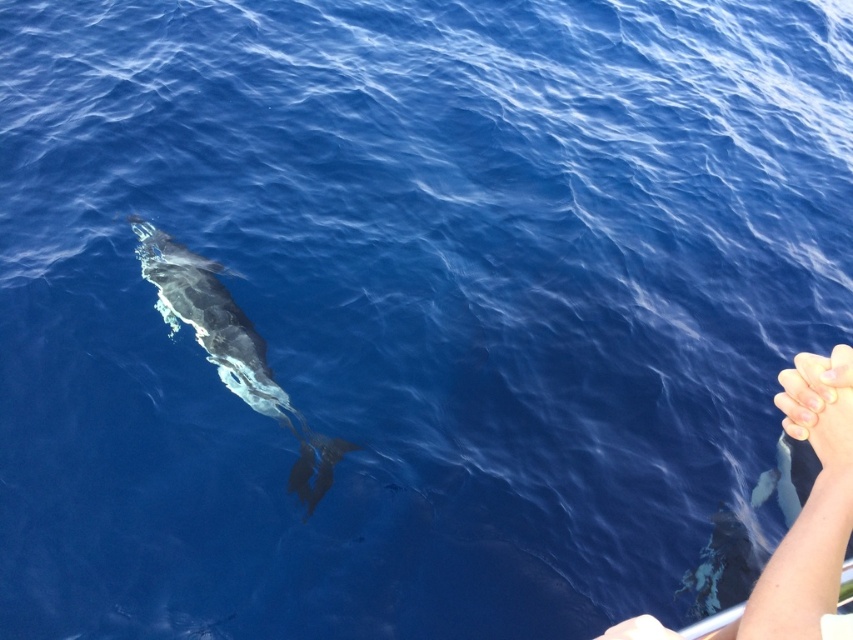
The height and width of the screenshot is (640, 853). What do you see at coordinates (808, 506) in the screenshot?
I see `skinny white arm at lower right` at bounding box center [808, 506].

Between skinny white arm at lower right and gray smooth whale at center, which one has less height?

skinny white arm at lower right is shorter.

This screenshot has height=640, width=853. Describe the element at coordinates (808, 506) in the screenshot. I see `skinny white arm at lower right` at that location.

This screenshot has width=853, height=640. What are the coordinates of `skinny white arm at lower right` in the screenshot? It's located at [808, 506].